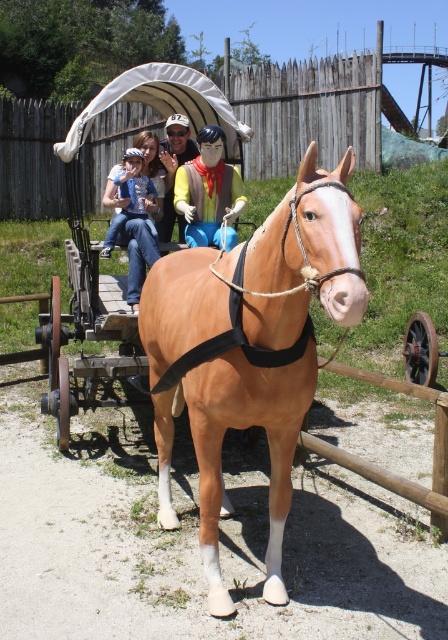
Which is more to the right, brown leather horse cart at center or rainbow fabric cowboy at center?

rainbow fabric cowboy at center is more to the right.

Does point (76, 173) come in front of point (219, 193)?

No.

This screenshot has height=640, width=448. I want to click on brown leather horse cart at center, so click(x=99, y=244).

Where is `brown leather horse cart at center`? The image size is (448, 640). brown leather horse cart at center is located at coordinates (99, 244).

Does point (301, 349) come in front of point (207, 150)?

Yes, point (301, 349) is in front of point (207, 150).

At what (x,y) coordinates should I click in order to perform the action: click on light brown glossy horse at center. Please return your answer as a coordinate pair (x, y). This screenshot has height=640, width=448. Looking at the image, I should click on (249, 348).

Does brown leather horse cart at center have a greater width compared to matte yellow shirt at center?

Indeed, brown leather horse cart at center has a greater width compared to matte yellow shirt at center.

Who is more forward, [420,333] or [218,138]?

Positioned in front is point [218,138].

Who is more forward, (x=128, y=300) or (x=229, y=170)?

Positioned in front is point (x=229, y=170).

At what (x,y) coordinates should I click in order to perform the action: click on brown leather horse cart at center. Please return your answer as a coordinate pair (x, y). The height and width of the screenshot is (640, 448). Looking at the image, I should click on (99, 244).